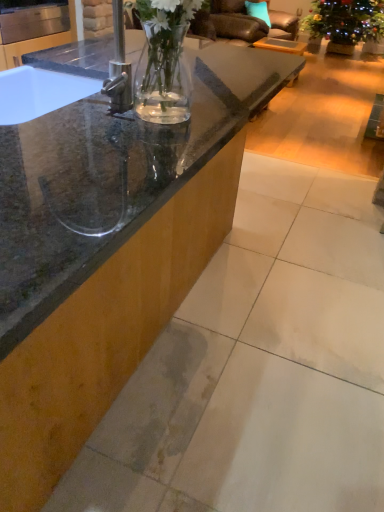
Question: Is wooden table at center bigger or smaller than teal fabric pillow at upper center?

Choices:
 (A) small
 (B) big

Answer: (B)

Question: Is point (261, 40) closer or farther from the camera than point (253, 13)?

Choices:
 (A) closer
 (B) farther

Answer: (B)

Question: Estimate the real-world distances between objects in this image. Which object is farther from the teal fabric pillow at upper center?

Choices:
 (A) leather armchair at upper center
 (B) wooden table at center
 (C) translucent glass sink at upper left
 (D) green leafy plant at upper right

Answer: (C)

Question: Which is nearer to the green leafy plant at upper right?

Choices:
 (A) wooden table at center
 (B) translucent glass sink at upper left
 (C) leather armchair at upper center
 (D) teal fabric pillow at upper center

Answer: (A)